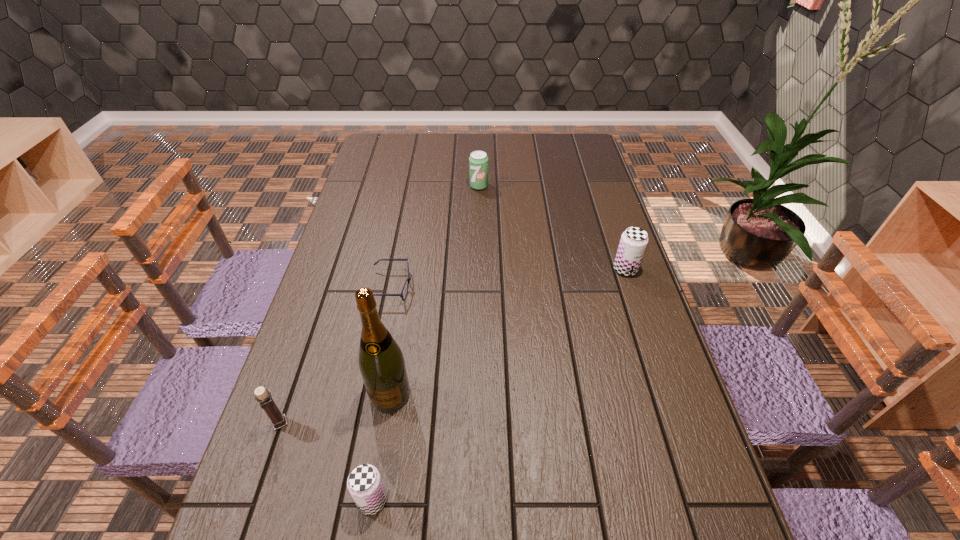
Identify the location of object at the right edge. The image size is (960, 540). (633, 242).

Locate an element on the screen. The width and height of the screenshot is (960, 540). vacant area at the far edge is located at coordinates (448, 134).

What are the coordinates of `vacant point at the left edge` in the screenshot? It's located at (323, 340).

Image resolution: width=960 pixels, height=540 pixels. I want to click on vacant area at the right edge of the desktop, so click(595, 205).

In the image, there is a desktop. Where is `vacant space at the far left corner`? The height and width of the screenshot is (540, 960). vacant space at the far left corner is located at coordinates (392, 140).

In the image, there is a desktop. At what (x,y) coordinates should I click in order to perform the action: click on vacant area at the near left corner. Please return your answer as a coordinate pair (x, y). Image resolution: width=960 pixels, height=540 pixels. Looking at the image, I should click on (276, 493).

Where is `free space at the far right corner of the desktop`? The height and width of the screenshot is (540, 960). free space at the far right corner of the desktop is located at coordinates (573, 136).

Identify the location of free spot between the right beer can and the spectacles. The height and width of the screenshot is (540, 960). (508, 278).

I want to click on vacant area between the farther beer can and the soda, so coord(552,228).

The height and width of the screenshot is (540, 960). In order to click on free space between the leftmost object and the second object from right to left in this screenshot , I will do `click(379, 305)`.